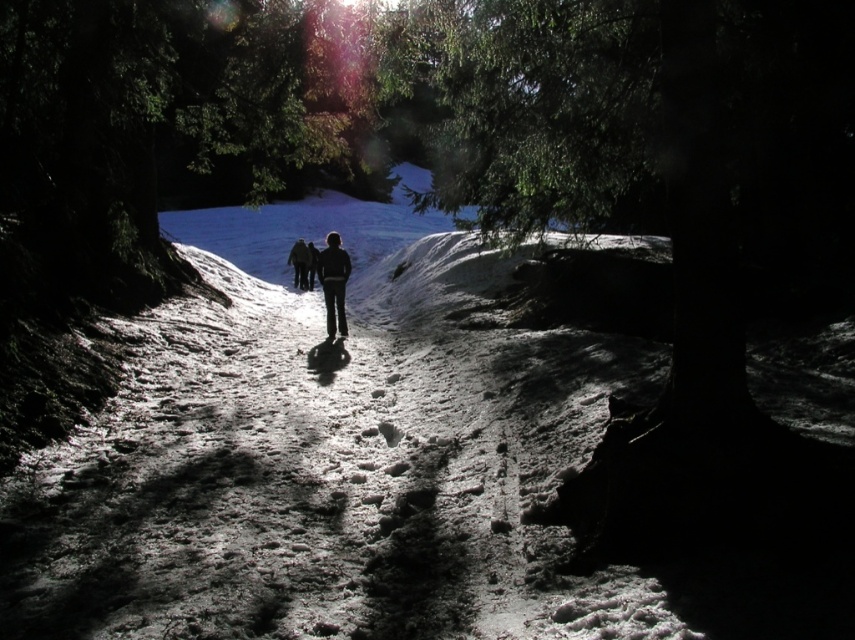
You are a photographer trying to capture the scene of three people walking on a snow path. You notice a black matte skier at center and a black matte jacket at center. Which object should you focus on first if you want to capture the skier and the jacket in the same frame?

The black matte skier at center is to the right of the black matte jacket at center, so you should focus on the black matte jacket at center first to ensure both are in the frame.

You are a photographer trying to capture the three individuals walking on the snow path. You notice the black matte skier at center and the black matte jacket at center. Which object should you focus on if you want to photograph the taller one?

The black matte jacket at center is taller than the black matte skier at center, so you should focus on the black matte jacket at center to photograph the taller one.